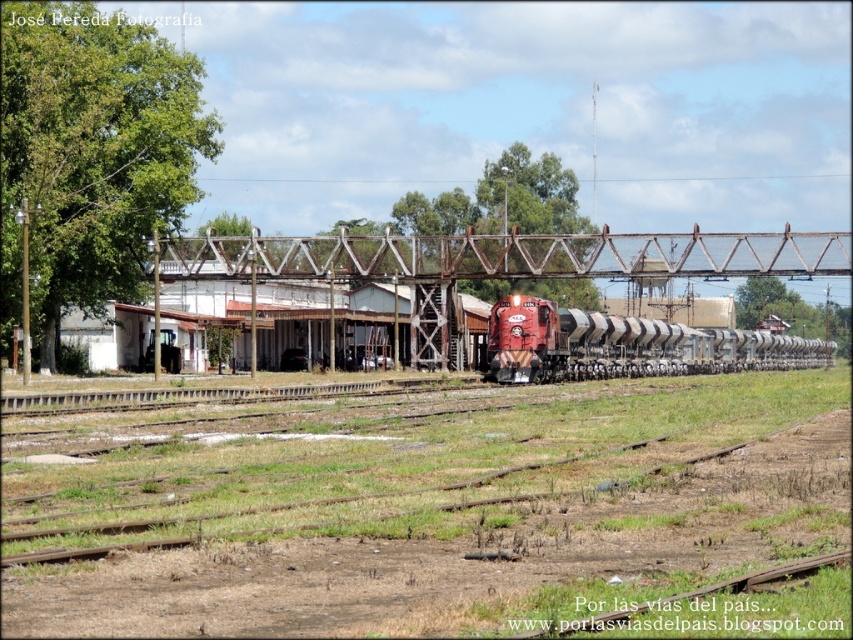
Question: Which point appears closest to the camera in this image?

Choices:
 (A) (485, 248)
 (B) (602, 372)

Answer: (A)

Question: Does rusty metal bridge at center appear on the right side of matte red locomotive at center?

Choices:
 (A) yes
 (B) no

Answer: (B)

Question: Is rusty metal bridge at center closer to the viewer compared to matte red locomotive at center?

Choices:
 (A) no
 (B) yes

Answer: (A)

Question: Is rusty metal bridge at center thinner than matte red locomotive at center?

Choices:
 (A) yes
 (B) no

Answer: (B)